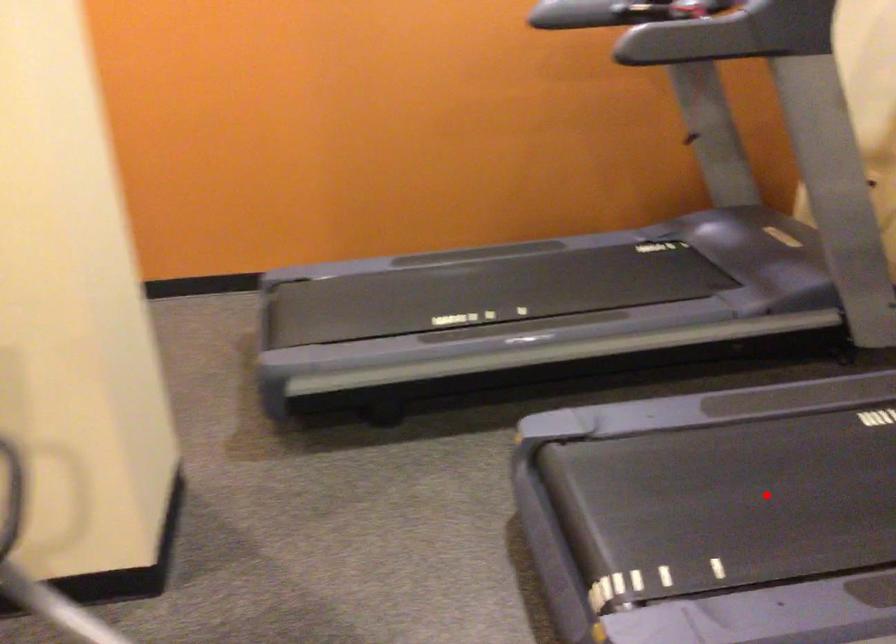
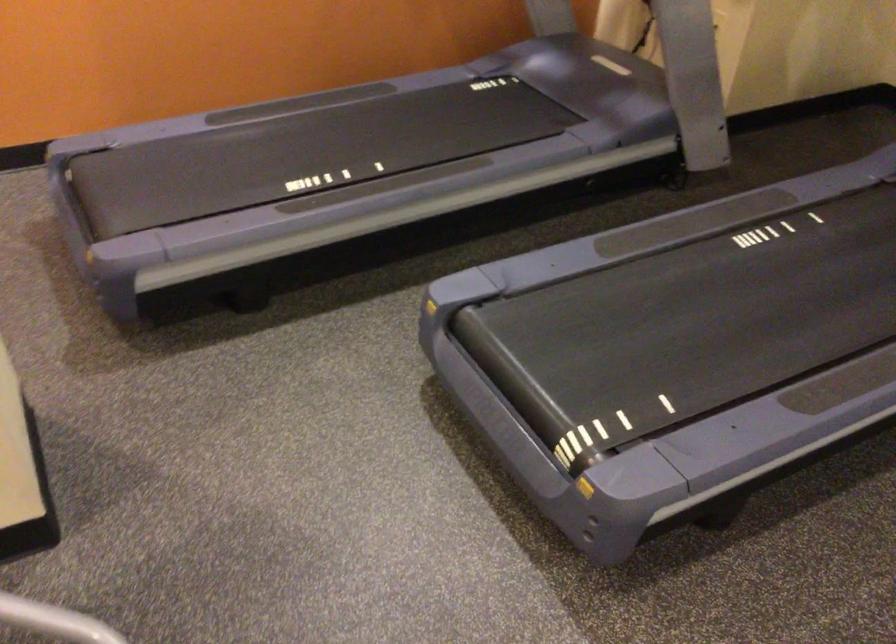
In the second image, find the point that corresponds to the highlighted location in the first image.

(682, 324)